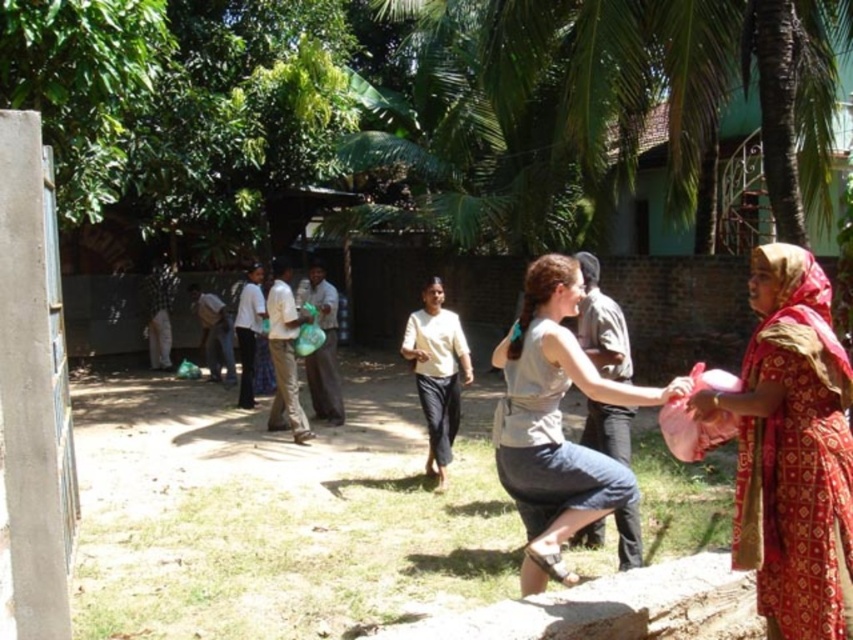
Question: Can you confirm if red printed sari at right is smaller than matte gray dress at center?

Choices:
 (A) no
 (B) yes

Answer: (B)

Question: Which point appears closest to the camera in this image?

Choices:
 (A) (817, 269)
 (B) (546, 493)

Answer: (A)

Question: Is red printed sari at right below matte gray dress at center?

Choices:
 (A) no
 (B) yes

Answer: (A)

Question: Which point is closer to the camera?

Choices:
 (A) matte gray dress at center
 (B) red printed sari at right

Answer: (B)

Question: Is red printed sari at right positioned in front of matte gray dress at center?

Choices:
 (A) yes
 (B) no

Answer: (A)